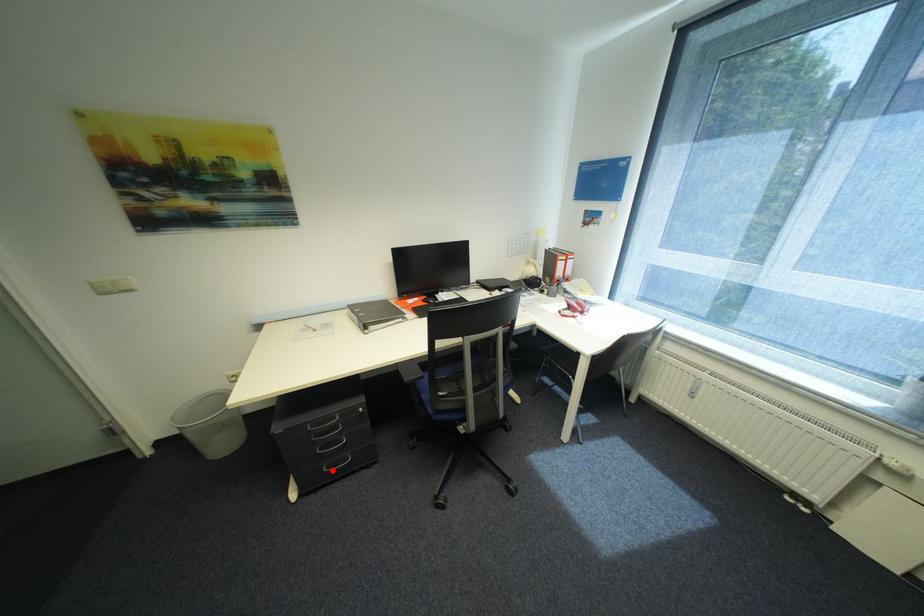
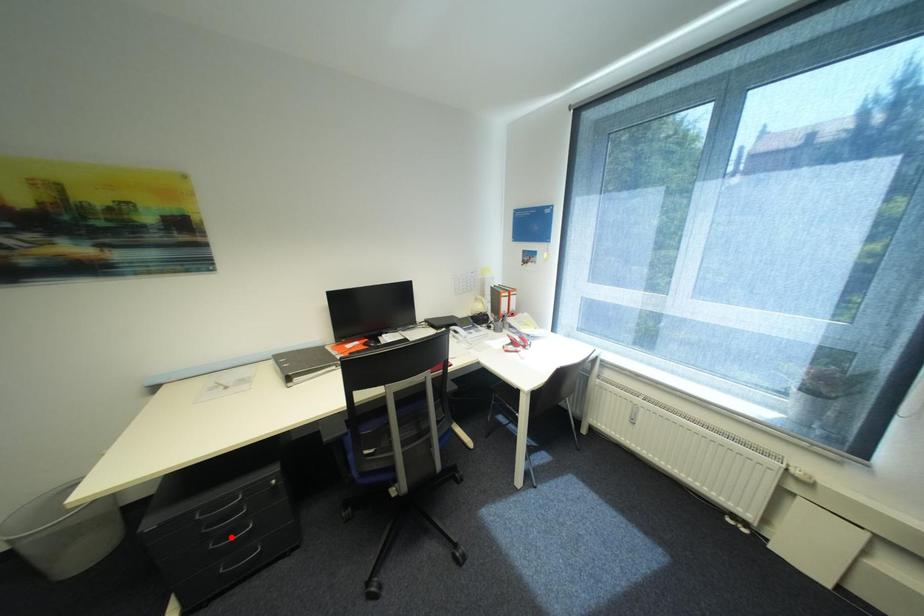
I am providing you with two images of the same scene from different viewpoints. A red point is marked on the first image and another point is marked on the second image. Is the red point in image1 aligned with the point shown in image2?

No